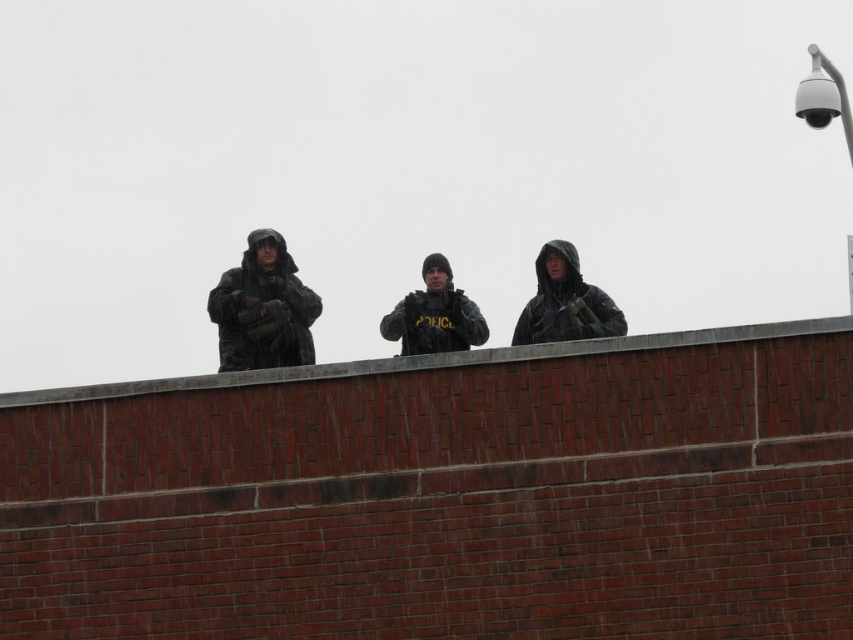
Question: Which of the following is the farthest from the observer?

Choices:
 (A) camouflage uniform at center
 (B) matte black jacket at center
 (C) camouflage fabric uniform at center

Answer: (A)

Question: Can you confirm if camouflage fabric uniform at center is bigger than matte black jacket at center?

Choices:
 (A) yes
 (B) no

Answer: (A)

Question: Among these points, which one is nearest to the camera?

Choices:
 (A) (614, 333)
 (B) (456, 326)

Answer: (A)

Question: Does matte black jacket at center have a larger size compared to camouflage uniform at center?

Choices:
 (A) no
 (B) yes

Answer: (B)

Question: Estimate the real-world distances between objects in this image. Which object is closer to the matte black jacket at center?

Choices:
 (A) camouflage uniform at center
 (B) camouflage fabric uniform at center

Answer: (A)

Question: Does camouflage fabric uniform at center appear on the right side of camouflage uniform at center?

Choices:
 (A) yes
 (B) no

Answer: (B)